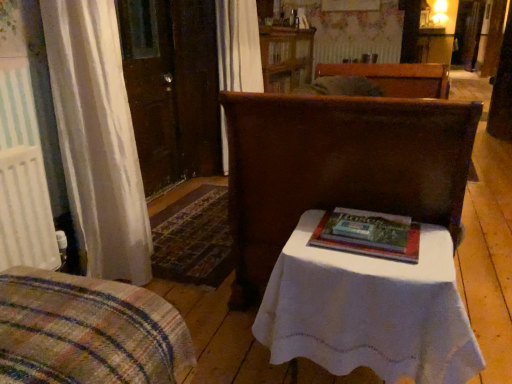
Identify the location of matte brown chair at center, the second furniture viewed from the front. (338, 168).

What is the approximate width of matte brown chair at center, the second furniture viewed from the front?

37.92 inches.

Describe the element at coordinates (369, 247) in the screenshot. I see `hardcover book at center` at that location.

Identify the location of white cloth-covered table at center. The image size is (512, 384). (369, 311).

Find the location of a particular element. wooden cabinet at upper center is located at coordinates (286, 57).

Where is `furniture above the hardcover book at center (from the image's perspective)`? This screenshot has width=512, height=384. furniture above the hardcover book at center (from the image's perspective) is located at coordinates (338, 168).

Is point (379, 175) closer or farther from the camera than point (391, 258)?

Point (379, 175) is positioned farther from the camera compared to point (391, 258).

In the scene shown: Which object is closer to the camera taking this photo, matte brown chair at center, the second furniture viewed from the front, or hardcover book at center?

matte brown chair at center, the second furniture viewed from the front, is more forward.

Is hardcover book at center surrounded by matte brown chair at center, which is the 1th furniture from back to front?

Indeed, hardcover book at center is located within matte brown chair at center, which is the 1th furniture from back to front.

Is plaid fabric bedspread at lower left, placed as the second furniture when sorted from back to front, aimed at matte brown chair at center, the second furniture viewed from the front?

No, plaid fabric bedspread at lower left, placed as the second furniture when sorted from back to front, is not turned towards matte brown chair at center, the second furniture viewed from the front.

Does point (53, 348) appear closer or farther from the camera than point (377, 108)?

Point (53, 348) appears to be closer to the viewer than point (377, 108).

Is plaid fabric bedspread at lower left, marked as the 2th furniture in a right-to-left arrangement, located outside matte brown chair at center, the 1th furniture in the right-to-left sequence?

Yes, plaid fabric bedspread at lower left, marked as the 2th furniture in a right-to-left arrangement, is outside of matte brown chair at center, the 1th furniture in the right-to-left sequence.

From the image's perspective, is plaid fabric bedspread at lower left, placed as the second furniture when sorted from back to front, located above or below matte brown chair at center, the second furniture viewed from the front?

From the image's perspective, plaid fabric bedspread at lower left, placed as the second furniture when sorted from back to front, appears below matte brown chair at center, the second furniture viewed from the front.

Between hardcover book at center and white cloth-covered table at center, which one has larger size?

Bigger between the two is white cloth-covered table at center.

Does hardcover book at center turn towards white cloth-covered table at center?

No, hardcover book at center is not turned towards white cloth-covered table at center.

Is plaid fabric bedspread at lower left, which appears as the 1th furniture when viewed from the front, thinner than wooden cabinet at upper center?

Incorrect, the width of plaid fabric bedspread at lower left, which appears as the 1th furniture when viewed from the front, is not less than that of wooden cabinet at upper center.

Between plaid fabric bedspread at lower left, which is counted as the 1th furniture, starting from the left, and wooden cabinet at upper center, which one has less height?

plaid fabric bedspread at lower left, which is counted as the 1th furniture, starting from the left, is shorter.

Considering the positions of objects plaid fabric bedspread at lower left, which appears as the 1th furniture when viewed from the front, and wooden cabinet at upper center in the image provided, who is more to the right, plaid fabric bedspread at lower left, which appears as the 1th furniture when viewed from the front, or wooden cabinet at upper center?

wooden cabinet at upper center.

Is plaid fabric bedspread at lower left, which is counted as the 1th furniture, starting from the left, smaller than wooden cabinet at upper center?

Indeed, plaid fabric bedspread at lower left, which is counted as the 1th furniture, starting from the left, has a smaller size compared to wooden cabinet at upper center.

Can you see plaid fabric bedspread at lower left, which is counted as the 1th furniture, starting from the left, touching white cloth-covered table at center?

No, plaid fabric bedspread at lower left, which is counted as the 1th furniture, starting from the left, is not in contact with white cloth-covered table at center.

Which of these two, plaid fabric bedspread at lower left, which is counted as the 1th furniture, starting from the left, or white cloth-covered table at center, is thinner?

white cloth-covered table at center.

Looking at the image, does plaid fabric bedspread at lower left, marked as the 2th furniture in a right-to-left arrangement, seem bigger or smaller compared to white cloth-covered table at center?

In the image, plaid fabric bedspread at lower left, marked as the 2th furniture in a right-to-left arrangement, appears to be larger than white cloth-covered table at center.

Where is `furniture in front of the matte brown chair at center, the 2th furniture viewed from the left`? The image size is (512, 384). furniture in front of the matte brown chair at center, the 2th furniture viewed from the left is located at coordinates (87, 331).

Can you tell me how much matte brown chair at center, the second furniture viewed from the front, and plaid fabric bedspread at lower left, which is counted as the 1th furniture, starting from the left, differ in facing direction?

The angle between the facing direction of matte brown chair at center, the second furniture viewed from the front, and the facing direction of plaid fabric bedspread at lower left, which is counted as the 1th furniture, starting from the left, is 1.14 degrees.

From their relative heights in the image, would you say matte brown chair at center, the 1th furniture in the right-to-left sequence, is taller or shorter than plaid fabric bedspread at lower left, which is counted as the 1th furniture, starting from the left?

Clearly, matte brown chair at center, the 1th furniture in the right-to-left sequence, is taller compared to plaid fabric bedspread at lower left, which is counted as the 1th furniture, starting from the left.

Is wooden cabinet at upper center located within white cloth-covered table at center?

No, wooden cabinet at upper center is located outside of white cloth-covered table at center.

Between white cloth-covered table at center and wooden cabinet at upper center, which one has smaller size?

With smaller size is white cloth-covered table at center.

From the image's perspective, is white cloth-covered table at center located above or below wooden cabinet at upper center?

white cloth-covered table at center is below wooden cabinet at upper center.

This screenshot has width=512, height=384. Identify the location of furniture above the hardcover book at center (from the image's perspective). (338, 168).

This screenshot has width=512, height=384. I want to click on furniture to the right of plaid fabric bedspread at lower left, marked as the 2th furniture in a right-to-left arrangement, so click(x=338, y=168).

Estimate the real-world distances between objects in this image. Which object is further from wooden cabinet at upper center, plaid fabric bedspread at lower left, which is counted as the 1th furniture, starting from the left, or matte brown chair at center, the 2th furniture viewed from the left?

Among the two, plaid fabric bedspread at lower left, which is counted as the 1th furniture, starting from the left, is located further to wooden cabinet at upper center.

Which object lies nearer to the anchor point hardcover book at center, plaid fabric bedspread at lower left, which appears as the 1th furniture when viewed from the front, or matte brown chair at center, which is the 1th furniture from back to front?

Among the two, matte brown chair at center, which is the 1th furniture from back to front, is located nearer to hardcover book at center.

Considering their positions, is white cloth-covered table at center positioned closer to wooden cabinet at upper center than matte brown chair at center, the 1th furniture in the right-to-left sequence?

Among the two, matte brown chair at center, the 1th furniture in the right-to-left sequence, is located nearer to wooden cabinet at upper center.

Based on their spatial positions, is white cloth-covered table at center or hardcover book at center further from matte brown chair at center, the 2th furniture viewed from the left?

The object further to matte brown chair at center, the 2th furniture viewed from the left, is white cloth-covered table at center.

Based on their spatial positions, is plaid fabric bedspread at lower left, placed as the second furniture when sorted from back to front, or hardcover book at center closer to wooden cabinet at upper center?

hardcover book at center is positioned closer to the anchor wooden cabinet at upper center.

Which object lies nearer to the anchor point hardcover book at center, wooden cabinet at upper center or plaid fabric bedspread at lower left, which appears as the 1th furniture when viewed from the front?

Based on the image, plaid fabric bedspread at lower left, which appears as the 1th furniture when viewed from the front, appears to be nearer to hardcover book at center.

Which object lies nearer to the anchor point plaid fabric bedspread at lower left, placed as the second furniture when sorted from back to front, wooden cabinet at upper center or white cloth-covered table at center?

white cloth-covered table at center lies closer to plaid fabric bedspread at lower left, placed as the second furniture when sorted from back to front, than the other object.

From the image, which object appears to be nearer to matte brown chair at center, the second furniture viewed from the front, wooden cabinet at upper center or plaid fabric bedspread at lower left, which appears as the 1th furniture when viewed from the front?

plaid fabric bedspread at lower left, which appears as the 1th furniture when viewed from the front, is positioned closer to the anchor matte brown chair at center, the second furniture viewed from the front.

You are a GUI agent. You are given a task and a screenshot of the screen. Output one action in this format:
    pyautogui.click(x=<x>, y=<y>)
    Task: Click on the book between matte brown chair at center, the second furniture viewed from the front, and white cloth-covered table at center from top to bottom
    The image size is (512, 384).
    Given the screenshot: What is the action you would take?
    pyautogui.click(x=369, y=247)

Locate an element on the screen. The width and height of the screenshot is (512, 384). table between plaid fabric bedspread at lower left, which appears as the 1th furniture when viewed from the front, and matte brown chair at center, the 1th furniture in the right-to-left sequence is located at coordinates (369, 311).

This screenshot has width=512, height=384. In order to click on book between matte brown chair at center, the 1th furniture in the right-to-left sequence, and wooden cabinet at upper center, along the z-axis in this screenshot , I will do `click(369, 247)`.

The height and width of the screenshot is (384, 512). Identify the location of furniture between plaid fabric bedspread at lower left, marked as the 2th furniture in a right-to-left arrangement, and wooden cabinet at upper center in the front-back direction. (338, 168).